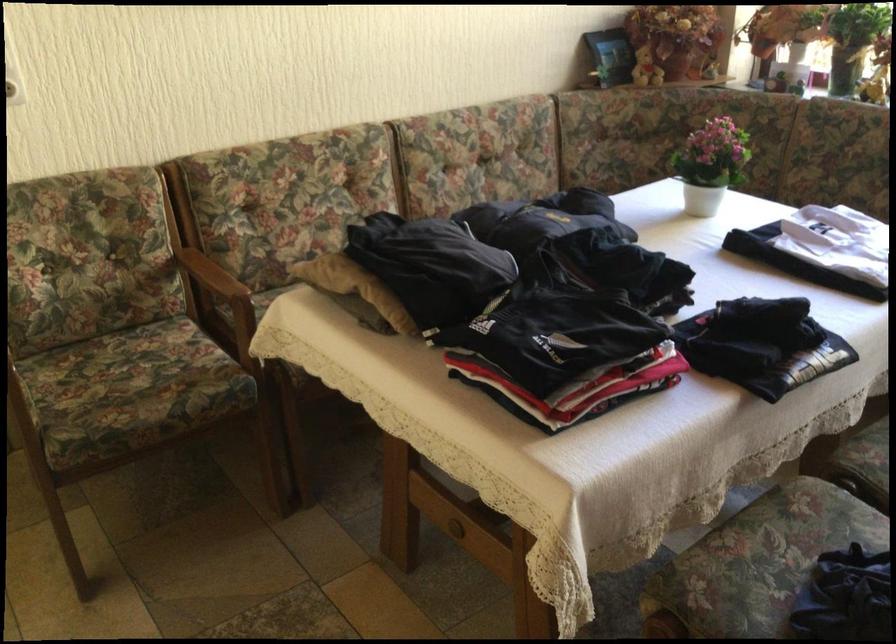
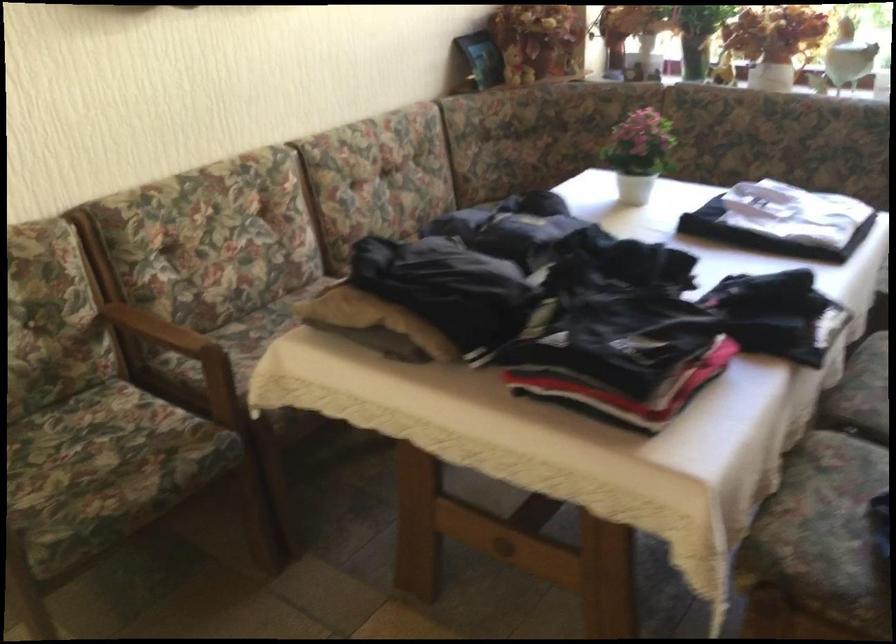
Find the pixel in the second image that matches point 332,272 in the first image.

(351, 307)